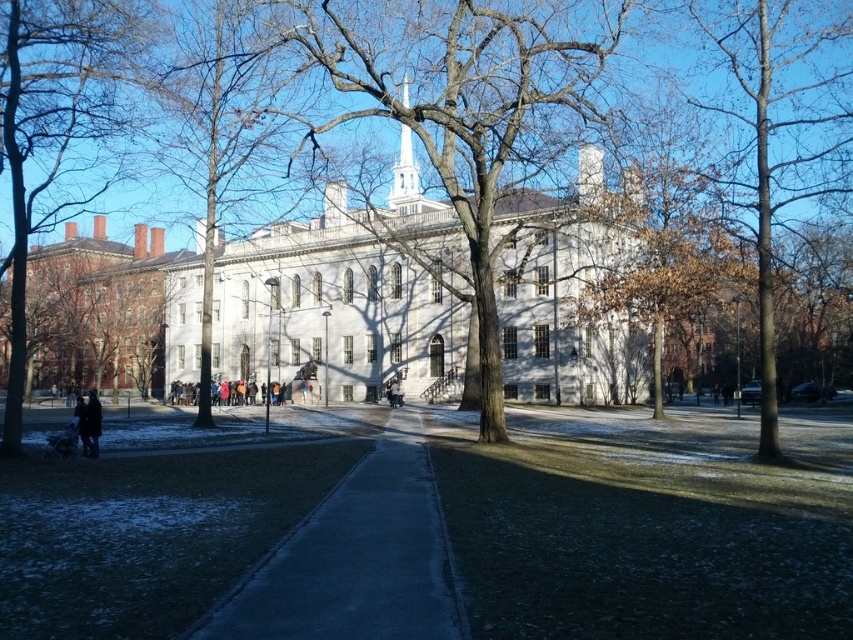
Question: Can you confirm if smooth concrete sidewalk at center is smaller than bare wood tree at left?

Choices:
 (A) no
 (B) yes

Answer: (B)

Question: Among these points, which one is farthest from the camera?

Choices:
 (A) (44, 64)
 (B) (563, 150)

Answer: (B)

Question: Which point is farther from the camera taking this photo?

Choices:
 (A) (695, 6)
 (B) (428, 96)

Answer: (B)

Question: Is bare wood tree at left positioned before dark blue jacket at lower left?

Choices:
 (A) no
 (B) yes

Answer: (B)

Question: Which point appears farthest from the camera in this image?

Choices:
 (A) (91, 454)
 (B) (415, 632)
 (C) (595, 35)

Answer: (C)

Question: Can you confirm if bare wood tree at left is smaller than brown wood tree at right?

Choices:
 (A) no
 (B) yes

Answer: (A)